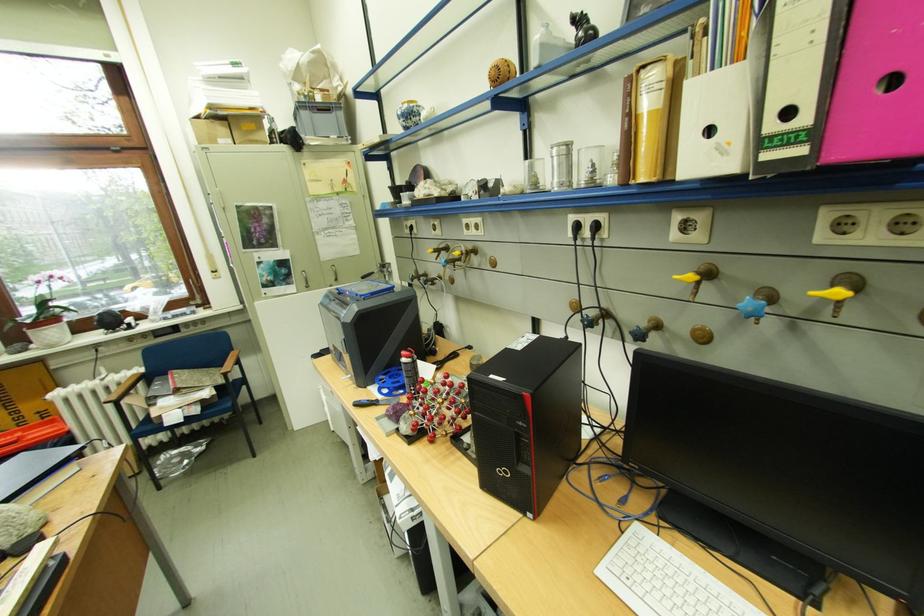
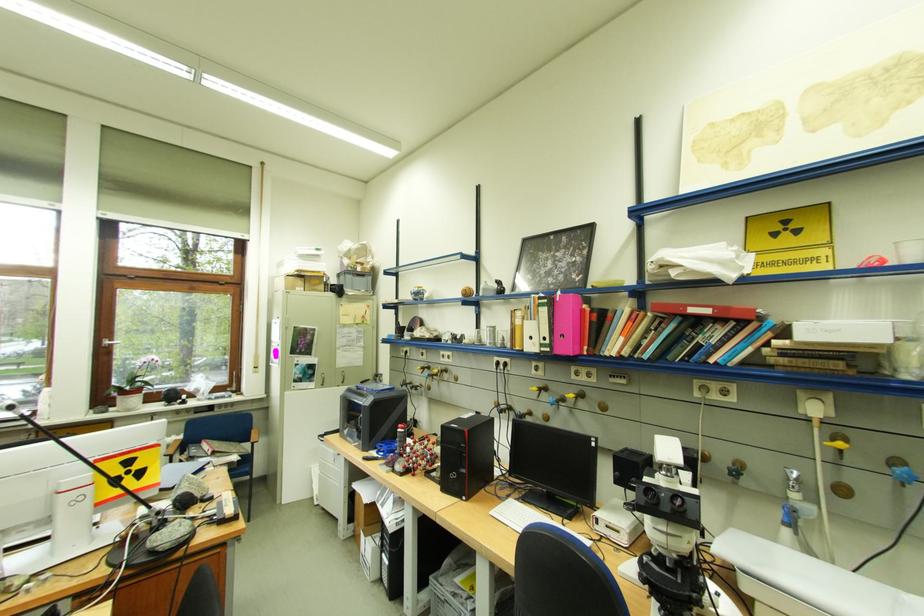
The point at (810, 152) is marked in the first image. Where is the corresponding point in the second image?

(558, 351)